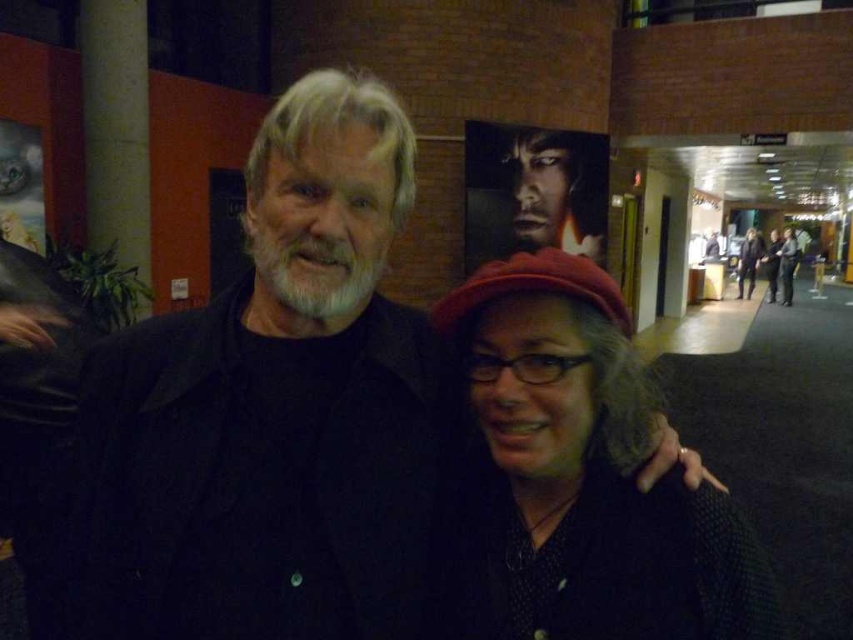
Question: Which of the following is the closest to the observer?

Choices:
 (A) (540, 170)
 (B) (750, 273)

Answer: (A)

Question: Where is smooth black face at center located in relation to dark gray sweater at center in the image?

Choices:
 (A) below
 (B) above

Answer: (B)

Question: Which object appears closest to the camera in this image?

Choices:
 (A) matte black sweater at center
 (B) dark gray sweater at center
 (C) smooth black face at center

Answer: (A)

Question: Is matte black sweater at center smaller than dark gray sweater at center?

Choices:
 (A) yes
 (B) no

Answer: (A)

Question: Among these points, which one is nearest to the camera?

Choices:
 (A) (577, 372)
 (B) (746, 246)

Answer: (A)

Question: In this image, where is matte black sweater at center located relative to dark gray sweater at center?

Choices:
 (A) below
 (B) above

Answer: (A)